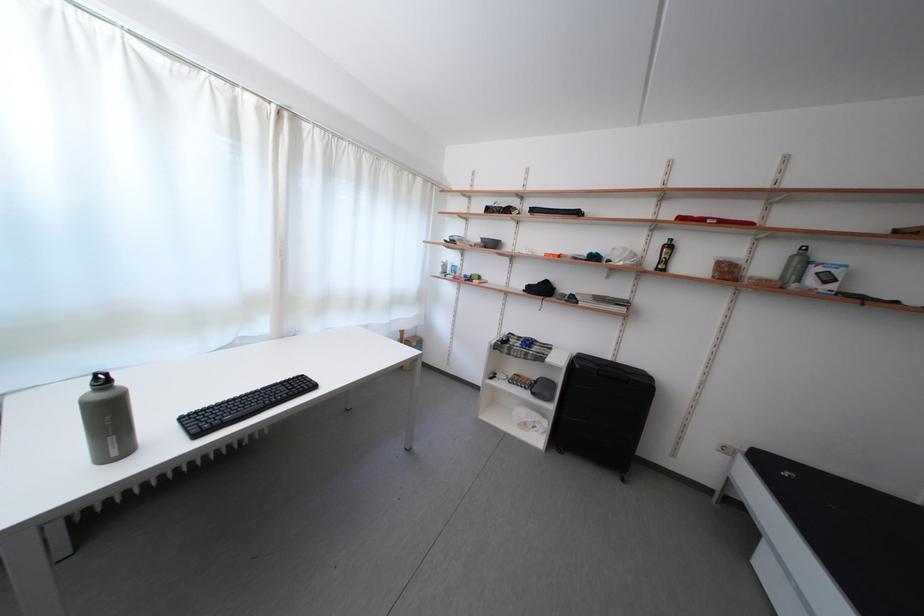
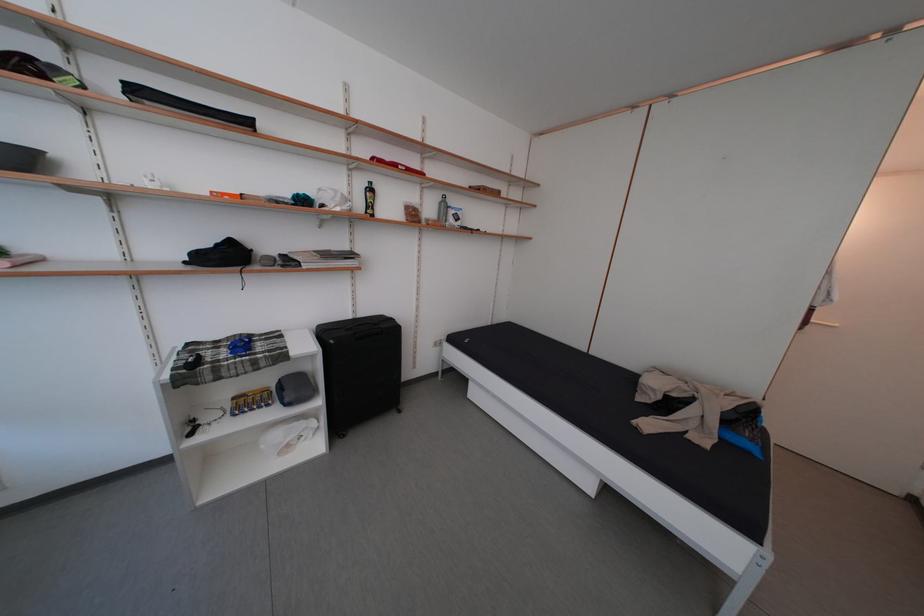
The images are taken continuously from a first-person perspective. In which direction is your viewpoint rotating?

The rotation direction of the camera is right-down.